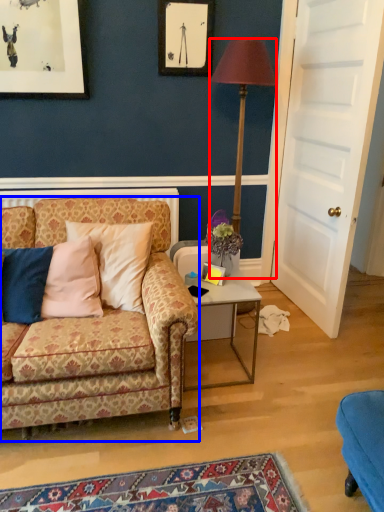
Question: Among these objects, which one is farthest to the camera, lamp (highlighted by a red box) or studio couch (highlighted by a blue box)?

Choices:
 (A) lamp
 (B) studio couch

Answer: (A)